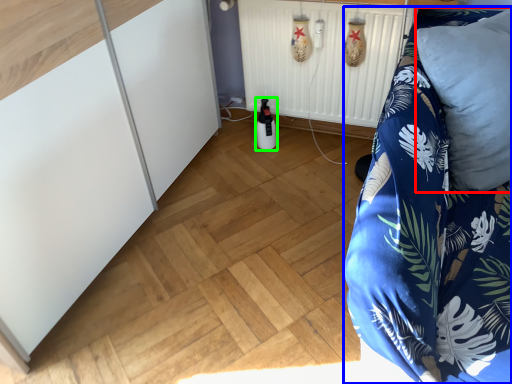
Question: Which object is positioned farthest from pillow (highlighted by a red box)? Select from furniture (highlighted by a blue box) and bottle (highlighted by a green box).

Choices:
 (A) furniture
 (B) bottle

Answer: (B)